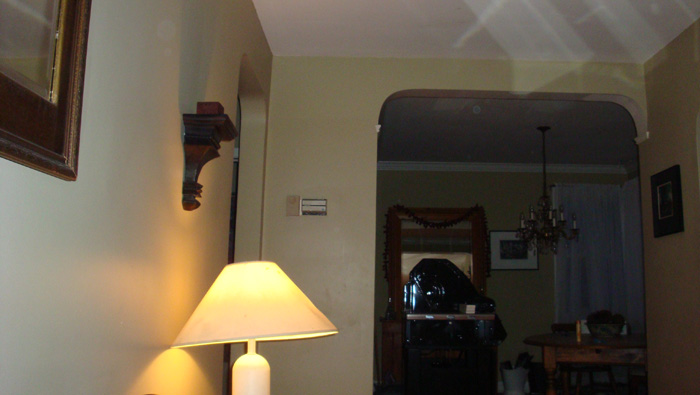
What are the coordinates of `picture` in the screenshot? It's located at (57, 124).